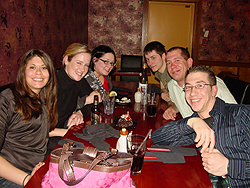
You are a GUI agent. You are given a task and a screenshot of the screen. Output one action in this format:
    pyautogui.click(x=<x>, y=<y>)
    Task: Click on the glass
    Image resolution: width=250 pixels, height=188 pixels.
    Given the screenshot: What is the action you would take?
    pyautogui.click(x=139, y=154), pyautogui.click(x=151, y=101), pyautogui.click(x=109, y=104), pyautogui.click(x=143, y=96)